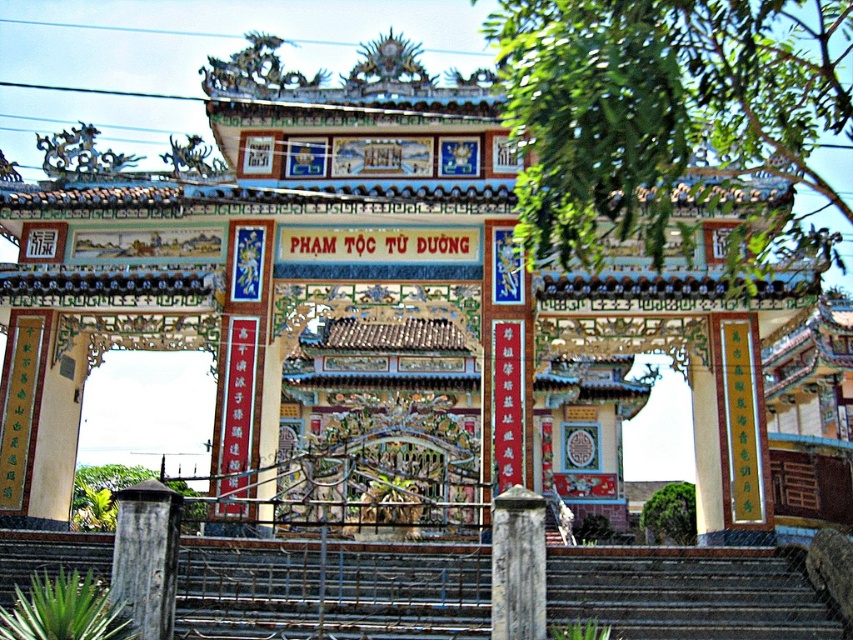
You are a tourist visiting the temple and need to climb the rusty metal stairs at center to reach the upper part of the gate. Before climbing, you want to compare the width of the stairs with the dark brown wooden post at lower left. Which one is wider?

The rusty metal stairs at center are wider than the dark brown wooden post at lower left according to the description.

You are a visitor at the temple entrance and want to climb up to the gate to take a closer look at the banner. However, you notice the rusty metal stairs at center and the dark brown wooden post at lower left. Which object is shorter and therefore safer to climb?

The rusty metal stairs at center is not as tall as the dark brown wooden post at lower left, so the rusty metal stairs at center is shorter and safer to climb.

You are standing at the entrance of the temple gate and see the point marked as point (685, 593). Is this point located on the rusty metal stairs at center?

Yes, the point (685, 593) is located on the rusty metal stairs at center as it is represented by that coordinate.